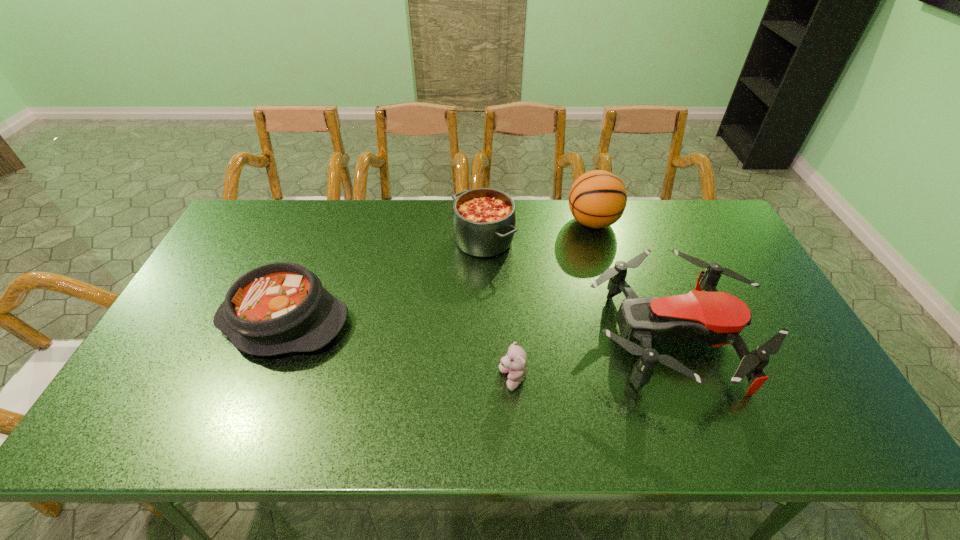
The width and height of the screenshot is (960, 540). I want to click on empty space between the tallest object and the leftmost object, so click(439, 272).

Locate an element on the screen. The width and height of the screenshot is (960, 540). free space between the drone and the tallest object is located at coordinates (632, 280).

Where is `empty location between the basketball and the leftmost object`? empty location between the basketball and the leftmost object is located at coordinates (439, 272).

You are a GUI agent. You are given a task and a screenshot of the screen. Output one action in this format:
    pyautogui.click(x=<x>, y=<y>)
    Task: Click on the empty space that is in between the nearer casserole and the teddy bear
    The width and height of the screenshot is (960, 540).
    Given the screenshot: What is the action you would take?
    pyautogui.click(x=398, y=350)

This screenshot has width=960, height=540. Find the location of `free point between the shorter casserole and the tallest object`. free point between the shorter casserole and the tallest object is located at coordinates [439, 272].

Locate which object is the third closest to the shorter casserole. Please provide its 2D coordinates. Your answer should be formatted as a tuple, i.e. [(x, y)], where the tuple contains the x and y coordinates of a point satisfying the conditions above.

[(717, 318)]

Locate an element on the screen. The height and width of the screenshot is (540, 960). object that is the fourth closest one to the tallest object is located at coordinates (277, 308).